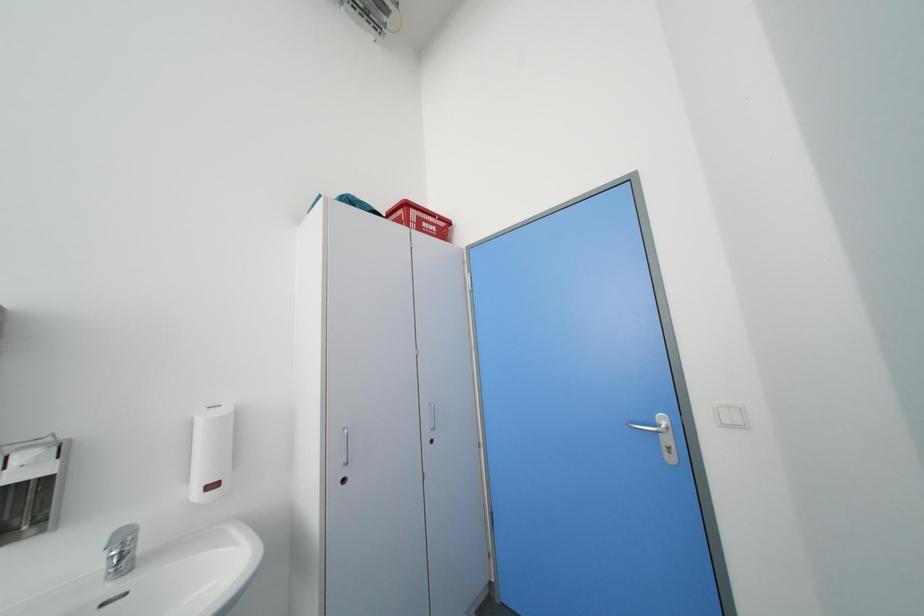
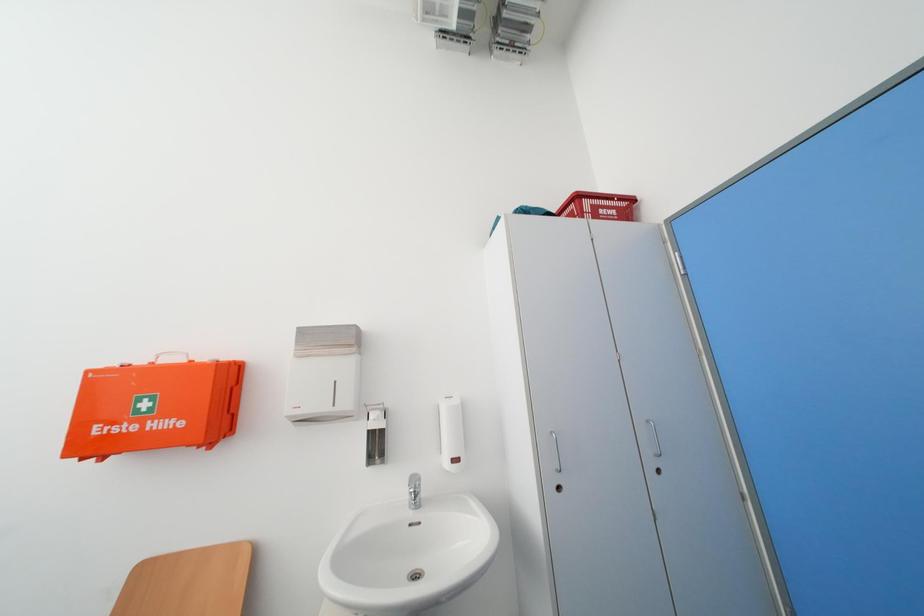
Question: The first image is from the beginning of the video and the second image is from the end. How did the camera likely rotate when shooting the video?

Choices:
 (A) Left
 (B) Right
 (C) Up
 (D) Down

Answer: (A)